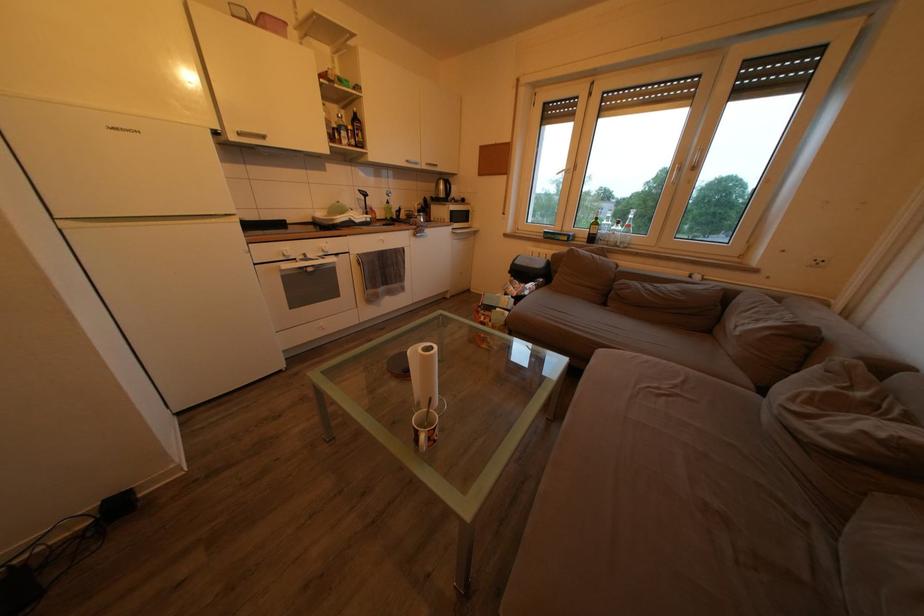
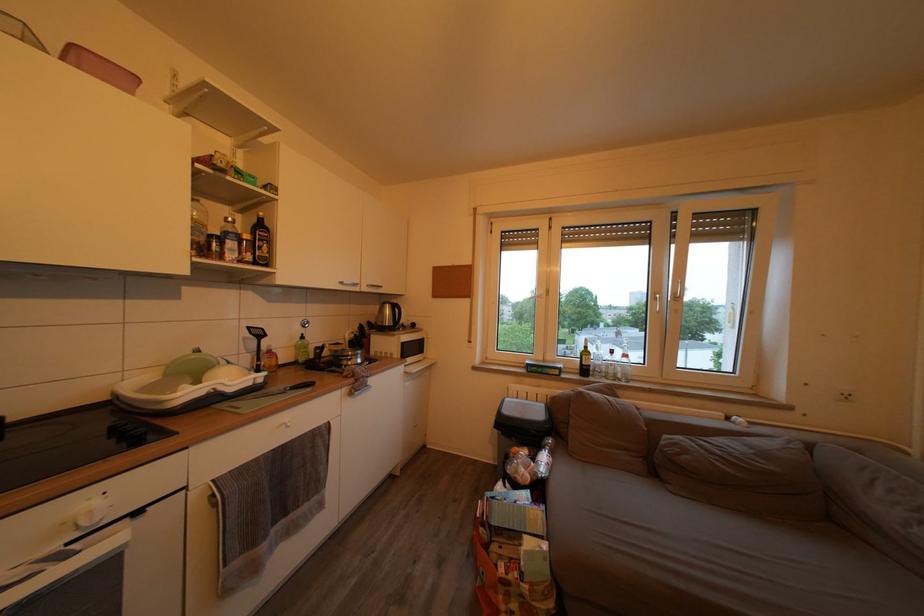
Where in the second image is the point corresponding to (619,246) from the first image?

(618, 378)